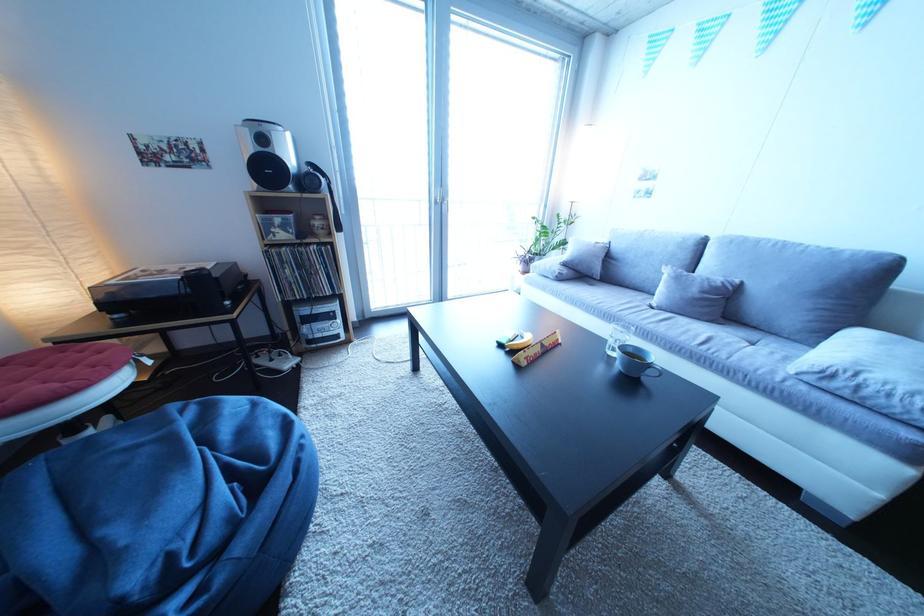
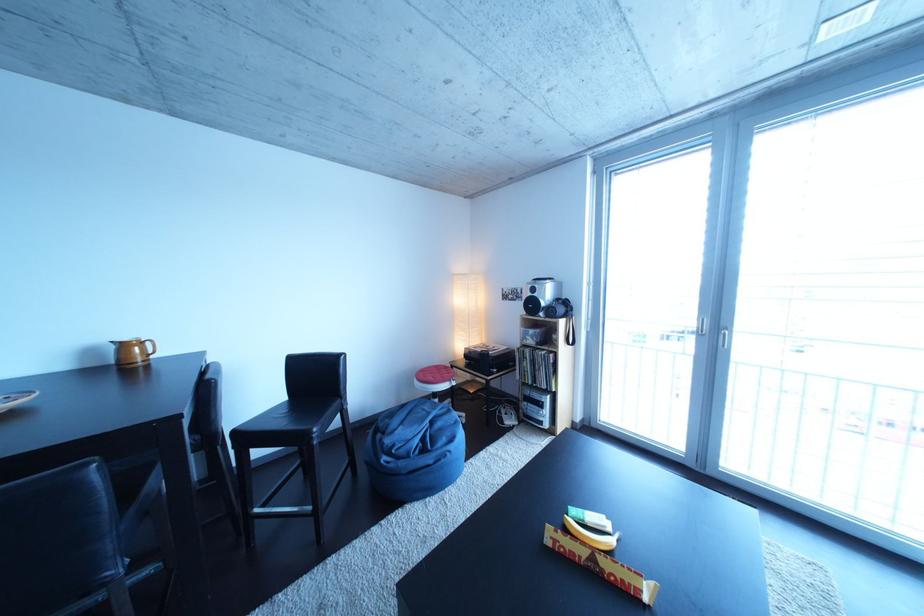
The point at (560, 350) is marked in the first image. Where is the corresponding point in the second image?

(617, 570)